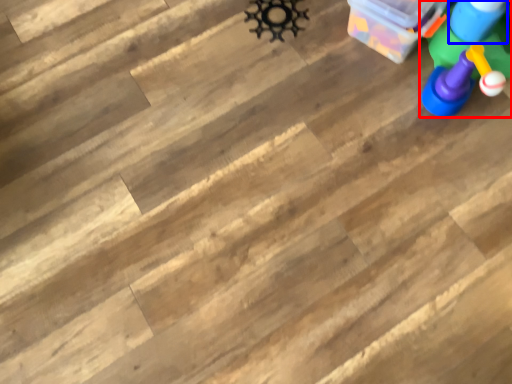
Question: Among these objects, which one is nearest to the camera, toy (highlighted by a red box) or toy (highlighted by a blue box)?

Choices:
 (A) toy
 (B) toy

Answer: (A)